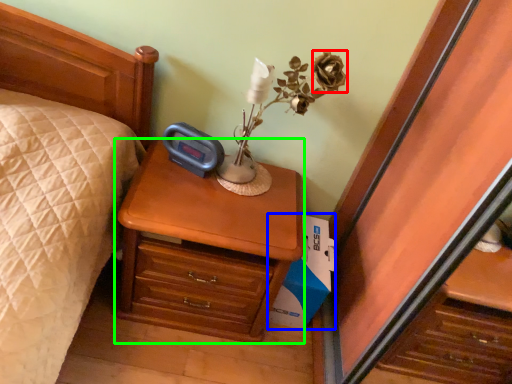
Question: Which is nearer to the flower (highlighted by a red box)? cardboard box (highlighted by a blue box) or nightstand (highlighted by a green box).

Choices:
 (A) cardboard box
 (B) nightstand

Answer: (B)